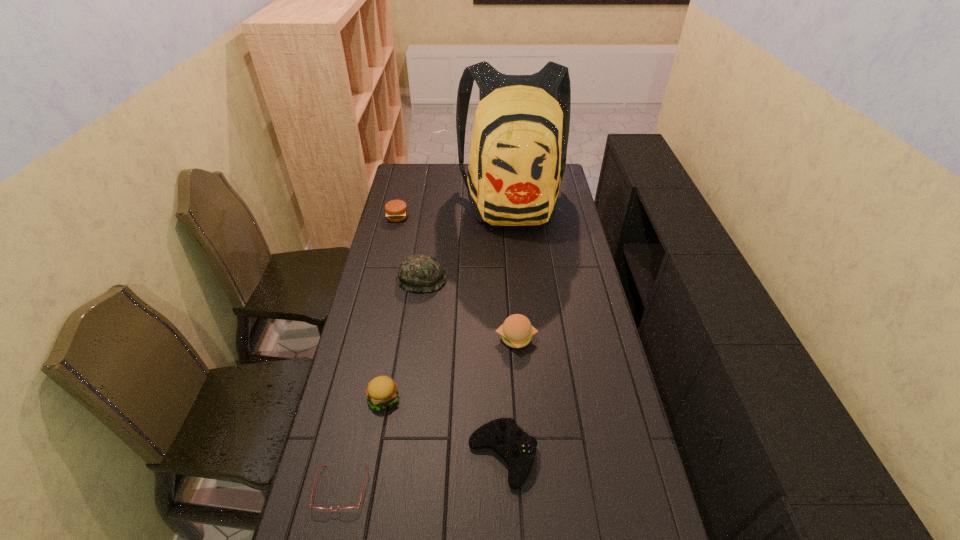
This screenshot has width=960, height=540. Find the location of `unoccupied position between the nearest hamburger and the fifth nearest object`. unoccupied position between the nearest hamburger and the fifth nearest object is located at coordinates (402, 339).

At what (x,y) coordinates should I click in order to perform the action: click on free point between the tallest object and the farthest hamburger. Please return your answer as a coordinate pair (x, y). This screenshot has height=540, width=960. Looking at the image, I should click on (455, 210).

This screenshot has height=540, width=960. I want to click on object that is the second closest to the control, so click(516, 331).

The height and width of the screenshot is (540, 960). In order to click on object that ranks as the second closest to the shortest object in this screenshot , I will do `click(518, 449)`.

Identify which hamburger is located as the second nearest to the shortest object. Please provide its 2D coordinates. Your answer should be formatted as a tuple, i.e. [(x, y)], where the tuple contains the x and y coordinates of a point satisfying the conditions above.

[(516, 331)]

You are a GUI agent. You are given a task and a screenshot of the screen. Output one action in this format:
    pyautogui.click(x=<x>, y=<y>)
    Task: Click on the hamburger that is the nearest to the nearest hamburger
    This screenshot has width=960, height=540.
    Given the screenshot: What is the action you would take?
    pyautogui.click(x=516, y=331)

You are a GUI agent. You are given a task and a screenshot of the screen. Output one action in this format:
    pyautogui.click(x=<x>, y=<y>)
    Task: Click on the vacant area in the image that satisfies the following two spatial constraints: 1. on the front side of the farthest hamburger; 2. on the left side of the nearest hamburger
    
    Given the screenshot: What is the action you would take?
    tap(355, 398)